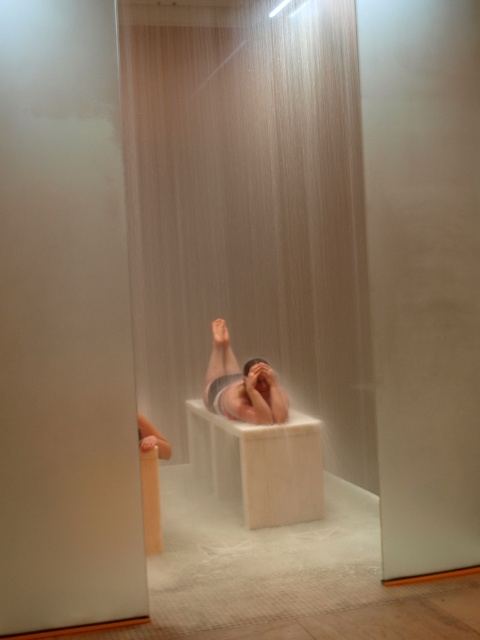
You are a caretaker in a medical facility and need to check the vital signs of the smooth skin man at center. The white matte bath at center is in the way. Can you move the bath to access him?

The white matte bath at center is positioned under smooth skin man at center, so you can move the bath to access him since it is beneath him.

What are the coordinates of the white matte bath at center in the image?

The white matte bath at center is located at coordinates point (259,465).

You are designing a new spa treatment that requires the white matte bath at center and the smooth skin man at center to be placed in a specific arrangement. Based on their sizes, which object should be positioned first to ensure proper placement?

The white matte bath at center should be positioned first since it has a larger size compared to the smooth skin man at center, ensuring there is enough space for both objects in the arrangement.